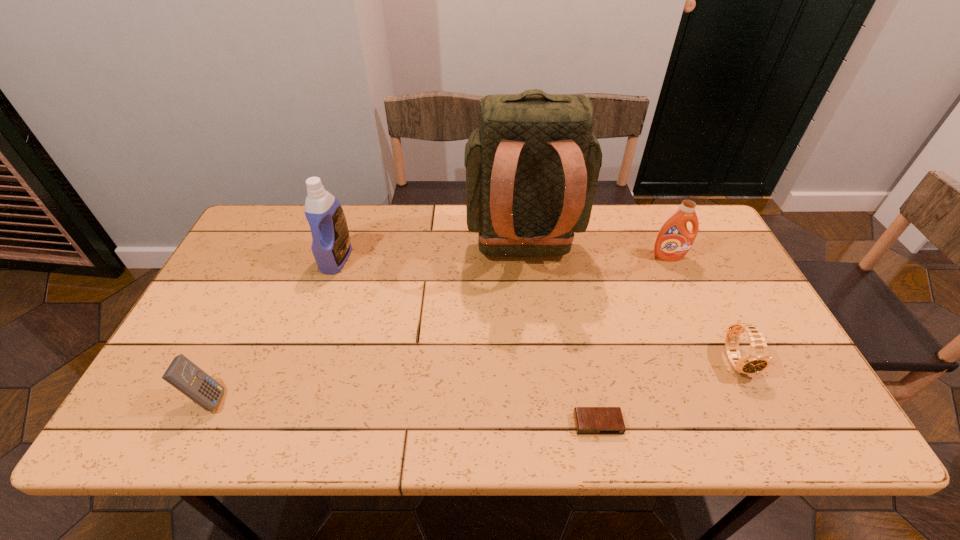
At what (x,y) coordinates should I click in order to perform the action: click on blank region between the tallest object and the watch. Please return your answer as a coordinate pair (x, y). This screenshot has width=960, height=540. Looking at the image, I should click on (630, 307).

This screenshot has height=540, width=960. I want to click on vacant space that is in between the third nearest object and the calculator, so click(x=472, y=380).

At what (x,y) coordinates should I click in order to perform the action: click on free space between the tallest object and the alarm clock. Please return your answer as a coordinate pair (x, y). Looking at the image, I should click on (561, 339).

Locate an element on the screen. The image size is (960, 540). free spot between the leftmost object and the left detergent is located at coordinates (272, 329).

At what (x,y) coordinates should I click in order to perform the action: click on empty location between the fifth shortest object and the shortest object. Please return your answer as a coordinate pair (x, y). Looking at the image, I should click on (467, 341).

Where is `blank region between the right detergent and the watch`? The image size is (960, 540). blank region between the right detergent and the watch is located at coordinates (703, 309).

Locate which object is the fourth closest to the calculator. Please provide its 2D coordinates. Your answer should be formatted as a tuple, i.e. [(x, y)], where the tuple contains the x and y coordinates of a point satisfying the conditions above.

[(757, 359)]

Find the location of a particular element. The width and height of the screenshot is (960, 540). object that stands as the second closest to the alarm clock is located at coordinates (532, 169).

The image size is (960, 540). Find the location of `free region that satisfies the following two spatial constraints: 1. on the front-facing side of the right detergent; 2. on the front-facing side of the calculator`. free region that satisfies the following two spatial constraints: 1. on the front-facing side of the right detergent; 2. on the front-facing side of the calculator is located at coordinates (732, 399).

You are a GUI agent. You are given a task and a screenshot of the screen. Output one action in this format:
    pyautogui.click(x=<x>, y=<y>)
    Task: Click on the vacant space that satisfies the following two spatial constraints: 1. on the face of the watch; 2. on the front-facing side of the leftmost object
    
    Given the screenshot: What is the action you would take?
    pyautogui.click(x=756, y=399)